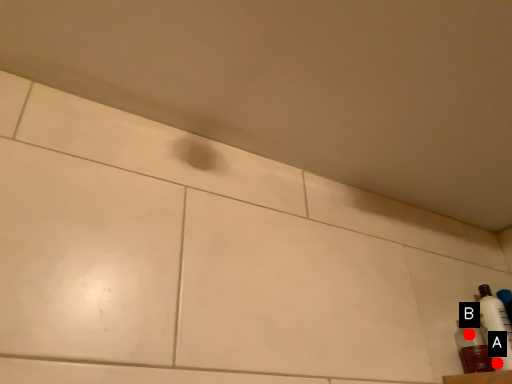
Question: Two points are circled on the image, labeled by A and B beside each circle. Among these points, which one is farthest from the camera?

Choices:
 (A) A is further
 (B) B is further

Answer: (B)